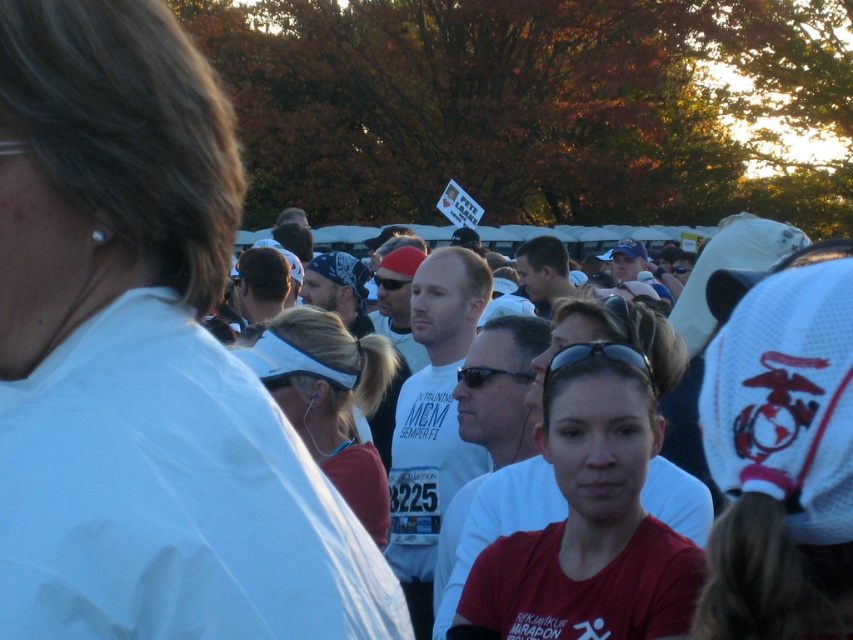
Question: Considering the real-world distances, which object is closest to the matte red shirt at center?

Choices:
 (A) white matte visor at center
 (B) white matte shirt at upper left

Answer: (A)

Question: Does matte red shirt at center appear on the right side of white matte visor at center?

Choices:
 (A) no
 (B) yes

Answer: (B)

Question: Which point is closer to the camera?

Choices:
 (A) black plastic sunglasses at center
 (B) white matte visor at center
 (C) matte red shirt at center
 (D) white matte shirt at upper left

Answer: (D)

Question: Considering the relative positions of matte red shirt at center and black plastic sunglasses at center in the image provided, where is matte red shirt at center located with respect to black plastic sunglasses at center?

Choices:
 (A) below
 (B) above

Answer: (A)

Question: Which of the following is the closest to the observer?

Choices:
 (A) white matte visor at center
 (B) matte red shirt at center
 (C) white matte shirt at upper left

Answer: (C)

Question: Is white matte visor at center wider than black plastic sunglasses at center?

Choices:
 (A) no
 (B) yes

Answer: (B)